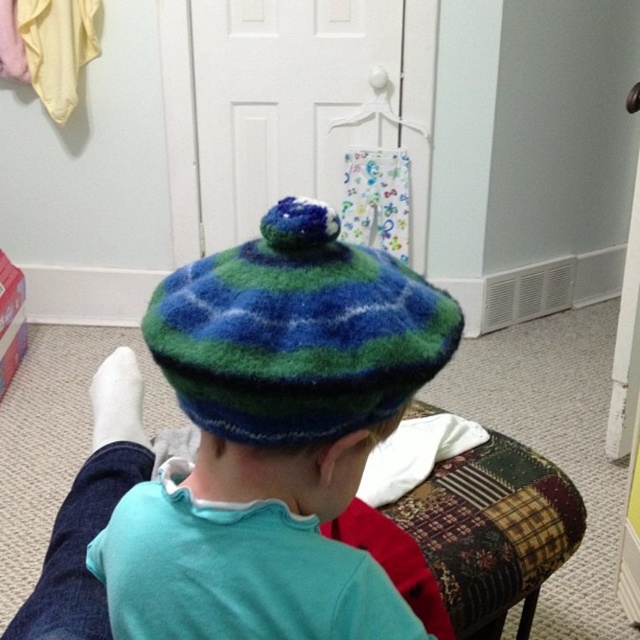
Is multicolored fuzzy beret at center wider than patchwork fabric stool at center?

No, multicolored fuzzy beret at center is not wider than patchwork fabric stool at center.

Does point (269, 476) come behind point (460, 612)?

No, it is in front of (460, 612).

Identify the location of multicolored fuzzy beret at center. The image size is (640, 640). (273, 436).

Who is lower down, multicolored knitted hat at center or white plastic hanger at upper center?

multicolored knitted hat at center

Looking at this image, is multicolored knitted hat at center to the right of white plastic hanger at upper center from the viewer's perspective?

In fact, multicolored knitted hat at center is to the left of white plastic hanger at upper center.

Which is behind, point (442, 291) or point (362, 116)?

Point (362, 116)

At what (x,y) coordinates should I click in order to perform the action: click on multicolored knitted hat at center. Please return your answer as a coordinate pair (x, y). Image resolution: width=640 pixels, height=640 pixels. Looking at the image, I should click on (298, 332).

Is point (458, 330) more distant than point (467, 486)?

No, it is in front of (467, 486).

Consider the image. Is multicolored knitted hat at center positioned before patchwork fabric stool at center?

That is True.

Between point (356, 419) and point (445, 595), which one is positioned behind?

Positioned behind is point (445, 595).

You are a GUI agent. You are given a task and a screenshot of the screen. Output one action in this format:
    pyautogui.click(x=<x>, y=<y>)
    Task: Click on the multicolored knitted hat at center
    The image size is (640, 640).
    Given the screenshot: What is the action you would take?
    pyautogui.click(x=298, y=332)